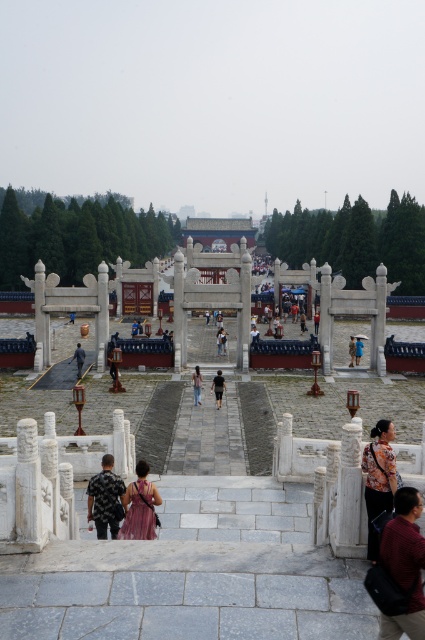
Can you confirm if dark gray fabric person at center is positioned below light blue fabric at center?

Indeed, dark gray fabric person at center is positioned under light blue fabric at center.

Where is `dark gray fabric person at center`? The height and width of the screenshot is (640, 425). dark gray fabric person at center is located at coordinates (79, 358).

Where is `dark gray fabric person at center`? The width and height of the screenshot is (425, 640). dark gray fabric person at center is located at coordinates (79, 358).

Where is `dark gray fabric person at center`? dark gray fabric person at center is located at coordinates (79, 358).

Between patterned fabric shirt at lower left and blue fabric umbrella at center, which one appears on the left side from the viewer's perspective?

Positioned to the left is patterned fabric shirt at lower left.

Which is below, patterned fabric shirt at lower left or blue fabric umbrella at center?

patterned fabric shirt at lower left is lower down.

Which is behind, point (96, 486) or point (357, 355)?

Positioned behind is point (357, 355).

At what (x,y) coordinates should I click in order to perform the action: click on patterned fabric shirt at lower left. Please return your answer as a coordinate pair (x, y). Looking at the image, I should click on (105, 499).

Based on the photo, is floral-patterned fabric at lower right in front of blue fabric umbrella at center?

Yes, it is in front of blue fabric umbrella at center.

Locate an element on the screen. This screenshot has height=640, width=425. floral-patterned fabric at lower right is located at coordinates (379, 477).